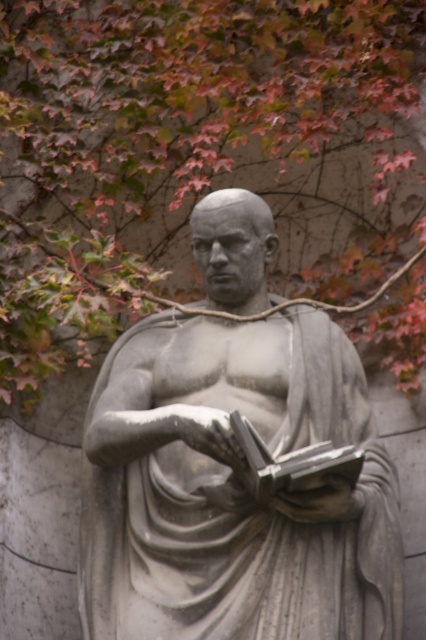
Between green leafy tree at upper center and matte gray stone book at center, which one has less height?

Standing shorter between the two is matte gray stone book at center.

Is point (106, 257) positioned before point (351, 448)?

No, (106, 257) is behind (351, 448).

Is point (89, 58) positioned in front of point (305, 458)?

No.

The image size is (426, 640). In order to click on green leafy tree at upper center in this screenshot , I will do `click(195, 152)`.

Can you confirm if gray stone statue at center is positioned to the right of matte gray stone book at center?

In fact, gray stone statue at center is to the left of matte gray stone book at center.

Between point (164, 445) and point (285, 456), which one is positioned in front?

Positioned in front is point (285, 456).

At what (x,y) coordinates should I click in order to perform the action: click on gray stone statue at center. Please return your answer as a coordinate pair (x, y). Image resolution: width=426 pixels, height=640 pixels. Looking at the image, I should click on (233, 488).

Can you confirm if green leafy tree at upper center is wider than gray stone statue at center?

Yes.

Between point (322, 192) and point (308, 380), which one is positioned behind?

Positioned behind is point (322, 192).

Which is in front, point (68, 348) or point (279, 620)?

Point (279, 620) is in front.

Find the location of a particular element. The width and height of the screenshot is (426, 640). green leafy tree at upper center is located at coordinates (195, 152).